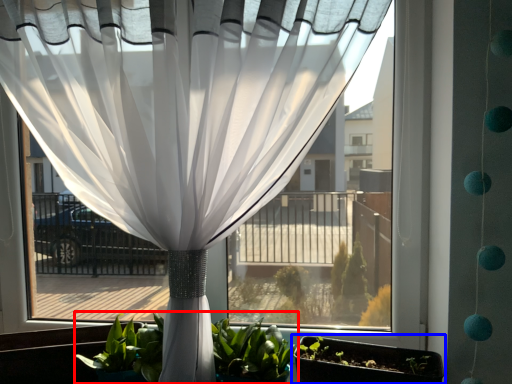
Question: Which object appears closest to the camera in this image, houseplant (highlighted by a red box) or flowerpot (highlighted by a blue box)?

Choices:
 (A) houseplant
 (B) flowerpot

Answer: (B)